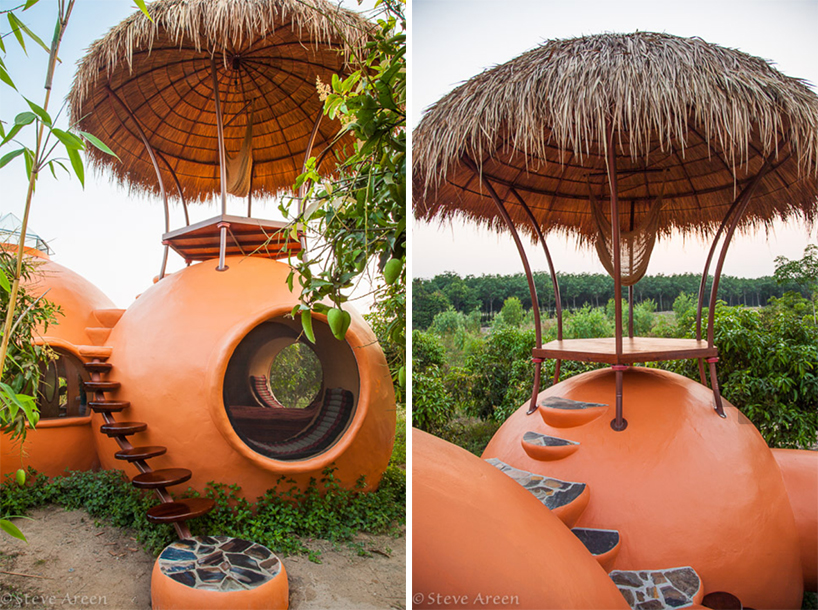
What are the coordinates of `plants on the right side` in the screenshot? It's located at (794, 343).